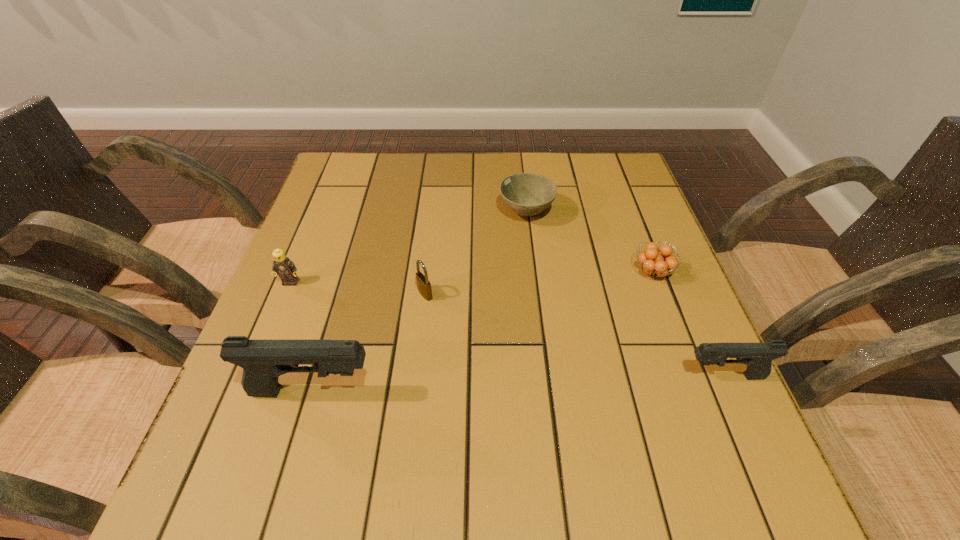
Find the location of a particular element. This screenshot has width=960, height=540. Lego that is at the left edge is located at coordinates (283, 266).

The height and width of the screenshot is (540, 960). What are the coordinates of `pistol at the right edge` in the screenshot? It's located at (758, 357).

Find the location of a particular element. orange fruit that is at the right edge is located at coordinates (656, 263).

The height and width of the screenshot is (540, 960). I want to click on object that is at the near left corner, so click(x=263, y=361).

The image size is (960, 540). In order to click on free location at the far edge of the desktop in this screenshot , I will do `click(569, 191)`.

In the image, there is a desktop. In order to click on blank space at the near edge in this screenshot , I will do `click(615, 417)`.

Image resolution: width=960 pixels, height=540 pixels. In the image, there is a desktop. In order to click on vacant space at the left edge in this screenshot , I will do `click(334, 276)`.

Find the location of a particular element. Image resolution: width=960 pixels, height=540 pixels. vacant area at the right edge of the desktop is located at coordinates (647, 370).

Identify the location of vacant region at the far left corner of the desktop. This screenshot has height=540, width=960. (330, 161).

I want to click on free space at the far right corner, so click(626, 158).